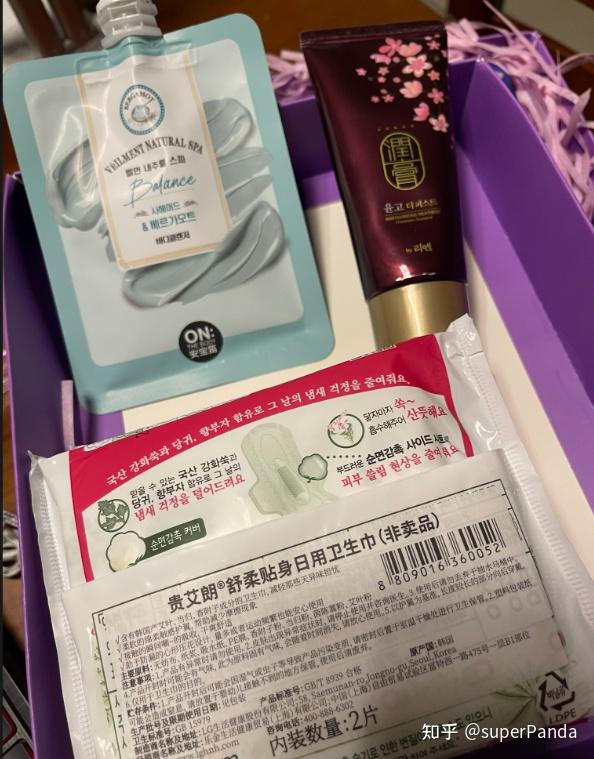
You are a GUI agent. You are given a task and a screenshot of the screen. Output one action in this format:
    pyautogui.click(x=<x>, y=<y>)
    Task: Click on the back wall
    The height and width of the screenshot is (759, 594).
    Given the screenshot: What is the action you would take?
    pyautogui.click(x=571, y=24)